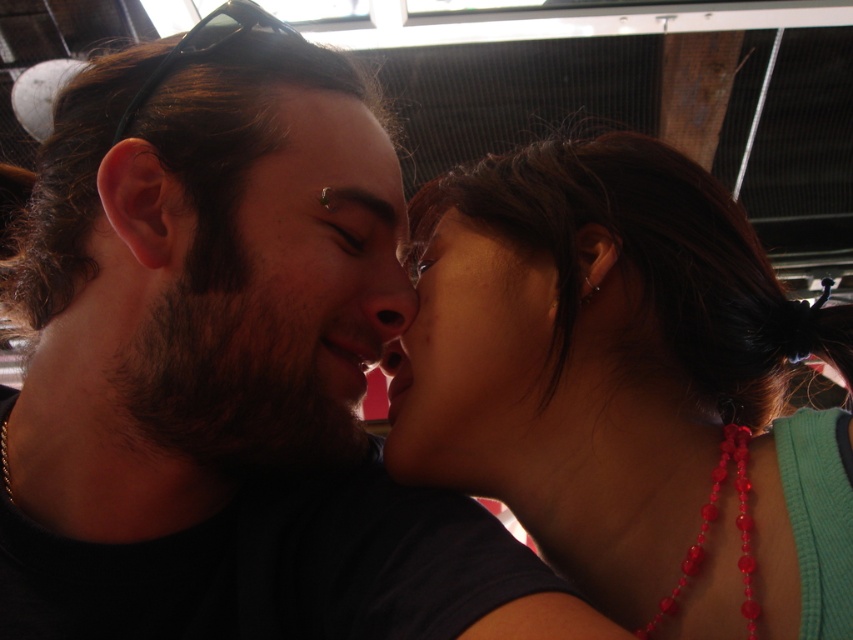
Question: Which point appears farthest from the camera in this image?

Choices:
 (A) (602, 593)
 (B) (587, 292)
 (C) (433, 310)
 (D) (469, 502)

Answer: (C)

Question: Can you confirm if matte black shirt at center is positioned below matte skin at center?

Choices:
 (A) yes
 (B) no

Answer: (A)

Question: Is teal fabric shirt at center thinner than smooth skin nose at center?

Choices:
 (A) yes
 (B) no

Answer: (B)

Question: Is matte black shirt at center positioned before matte skin at center?

Choices:
 (A) yes
 (B) no

Answer: (A)

Question: Based on their relative distances, which object is farther from the silver metallic ring at ear?

Choices:
 (A) smooth skin face at center
 (B) teal fabric shirt at center
 (C) matte skin at center
 (D) matte black shirt at center

Answer: (D)

Question: Which point is closer to the camera taking this photo?

Choices:
 (A) (380, 179)
 (B) (585, 296)
 (C) (403, 268)
 (D) (639, 630)

Answer: (D)